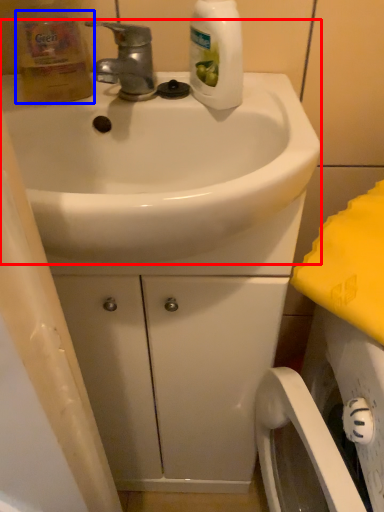
Question: Among these objects, which one is farthest to the camera, sink (highlighted by a red box) or cleaning product (highlighted by a blue box)?

Choices:
 (A) sink
 (B) cleaning product

Answer: (B)